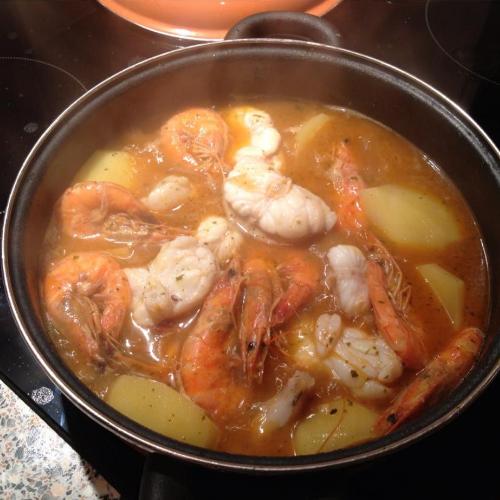
I want to click on grey marbled laminate countertop, so click(36, 455).